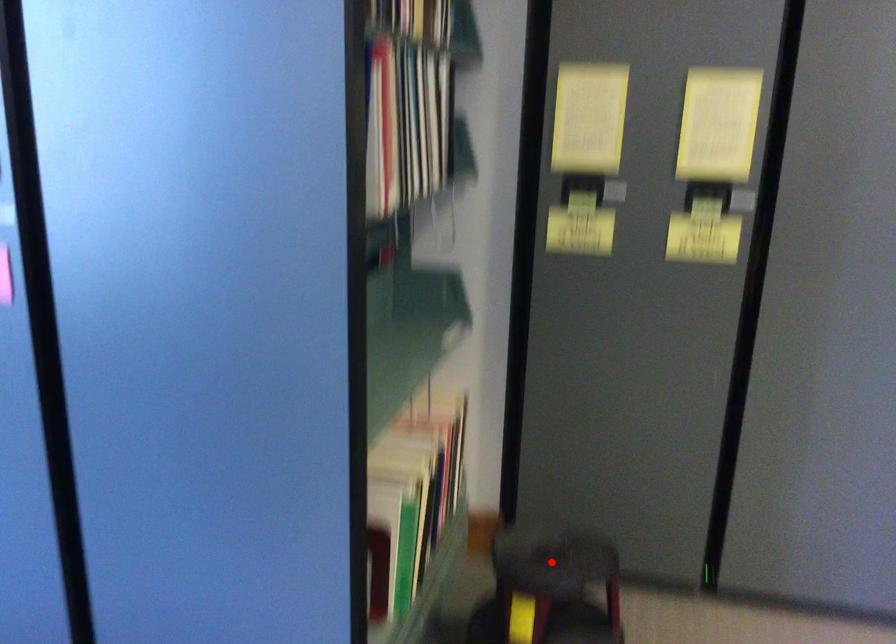
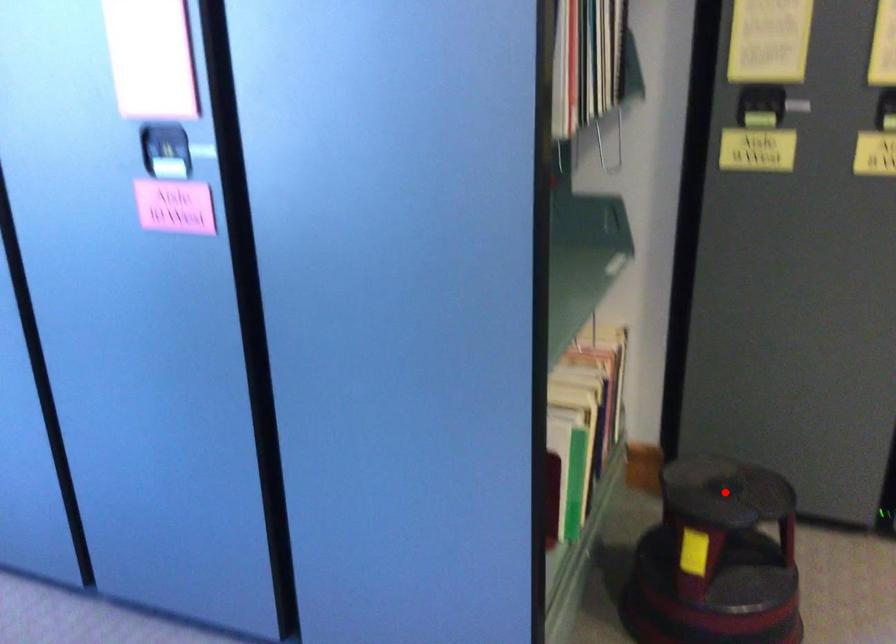
I am providing you with two images of the same scene from different viewpoints. A red point is marked on the first image and another point is marked on the second image. Is the marked point in image1 the same physical position as the marked point in image2?

Yes